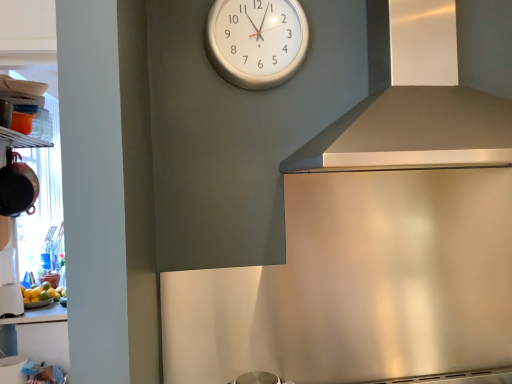
Question: Is white glossy cup at lower left, which ranks as the 2th appliance in top-to-bottom order, in front of or behind satin silver exhaust hood at upper right in the image?

Choices:
 (A) behind
 (B) front

Answer: (A)

Question: Based on their sizes in the image, would you say white glossy cup at lower left, which ranks as the 2th appliance in top-to-bottom order, is bigger or smaller than satin silver exhaust hood at upper right?

Choices:
 (A) big
 (B) small

Answer: (B)

Question: Considering the real-world distances, which object is closest to the white glossy cup at lower left, which is counted as the first appliance, starting from the bottom?

Choices:
 (A) white glossy clock at upper center
 (B) yellow matte bowl at lower left
 (C) matte black pot at left, the first appliance from the top
 (D) satin silver exhaust hood at upper right

Answer: (B)

Question: Which is nearer to the matte black pot at left, the 2th appliance in the bottom-to-top sequence?

Choices:
 (A) satin silver exhaust hood at upper right
 (B) white glossy cup at lower left, which is counted as the first appliance, starting from the bottom
 (C) white glossy clock at upper center
 (D) yellow matte bowl at lower left

Answer: (B)